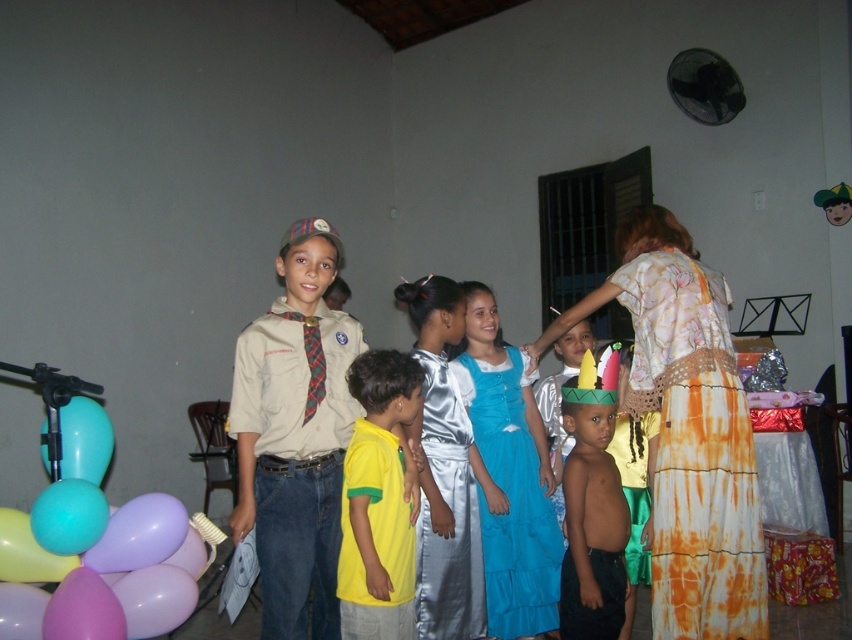
You are a photographer at the birthday party. You want to take a photo of the blue satin dress at center and the pastel balloons at lower left. Where should you position yourself to capture both subjects in the frame?

You should position yourself to the right of both the pastel balloons at lower left and the blue satin dress at center since the pastel balloons at lower left is to the left of blue satin dress at center.

In the scene shown: You are a photographer trying to capture a group photo of the batik orange dress at right and the translucent blue balloon at lower left. If you want to ensure both fit in the frame, which object should you focus on to avoid cropping?

The batik orange dress at right is wider than the translucent blue balloon at lower left, so you should focus on the batik orange dress at right to ensure it fits in the frame without cropping.

You are a photographer standing at point (171, 524) and want to take a photo of the group of children. The camera you have can only focus on subjects within 2.5 meters. Will you be able to capture the entire group in focus?

The distance between you and the group is 3.06 meters, which is beyond the camera focus range of 2.5 meters. Therefore, you won,t be able to capture the entire group in focus.